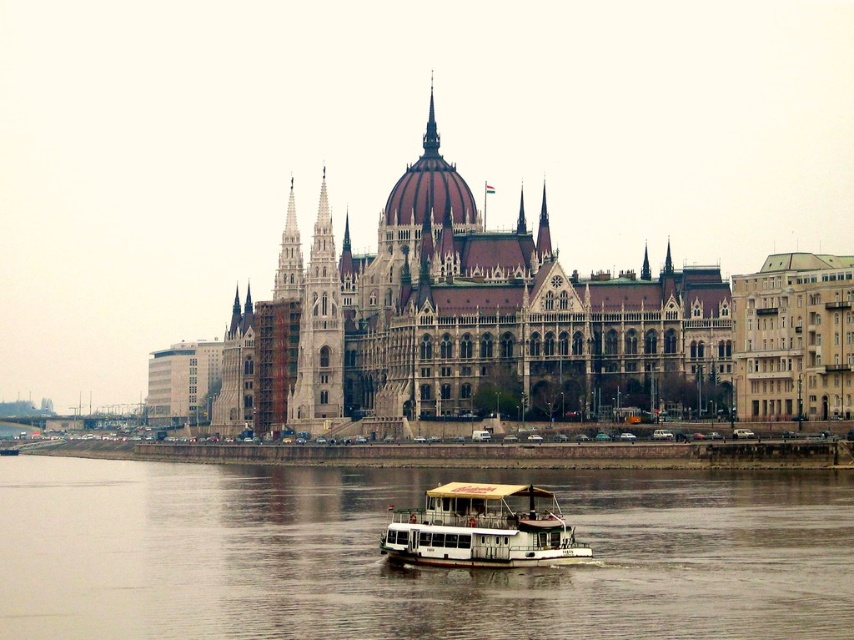
Question: Which object is farther from the camera taking this photo?

Choices:
 (A) white stone tower at center
 (B) brown water at center

Answer: (A)

Question: Which of these objects is positioned farthest from the brown stone building at center?

Choices:
 (A) white plastic boat at center
 (B) brown water at center

Answer: (A)

Question: Is brown water at center positioned in front of white plastic boat at center?

Choices:
 (A) yes
 (B) no

Answer: (A)

Question: Which point is farther to the camera?

Choices:
 (A) brown water at center
 (B) brown stone building at center
 (C) white stone tower at center
 (D) white plastic boat at center

Answer: (C)

Question: Where is brown water at center located in relation to brown stone building at center in the image?

Choices:
 (A) right
 (B) left

Answer: (B)

Question: Is brown stone building at center thinner than white plastic boat at center?

Choices:
 (A) yes
 (B) no

Answer: (B)